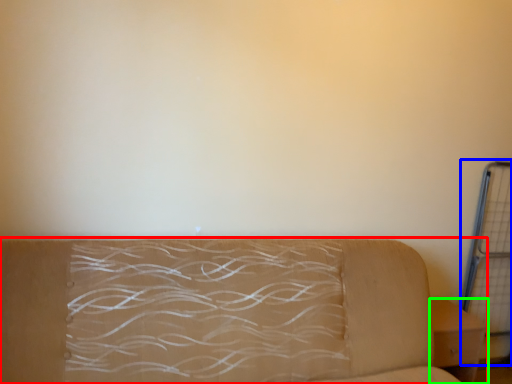
Question: Which object is positioned closest to studio couch (highlighted by a red box)? Select from cage (highlighted by a blue box) and furniture (highlighted by a green box).

Choices:
 (A) cage
 (B) furniture

Answer: (B)